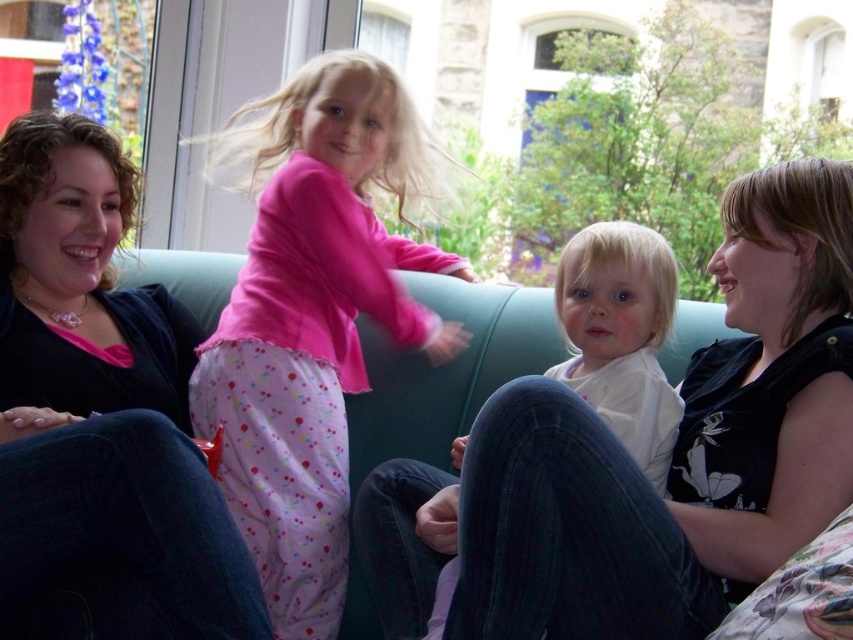
Question: Which of the following is the closest to the observer?

Choices:
 (A) white matte shirt at center
 (B) matte black sweater at left

Answer: (B)

Question: Is matte black sweater at left thinner than white soft fabric at center?

Choices:
 (A) yes
 (B) no

Answer: (B)

Question: Is matte black sweater at left to the right of pink cotton pajamas at center from the viewer's perspective?

Choices:
 (A) no
 (B) yes

Answer: (A)

Question: Is white soft fabric at center below white matte shirt at center?

Choices:
 (A) yes
 (B) no

Answer: (A)

Question: Which of the following is the closest to the observer?

Choices:
 (A) pink cotton pajamas at center
 (B) white matte shirt at center
 (C) green fabric couch at center
 (D) matte black sweater at left

Answer: (D)

Question: Which point is closer to the camera?

Choices:
 (A) (610, 339)
 (B) (697, 451)

Answer: (B)